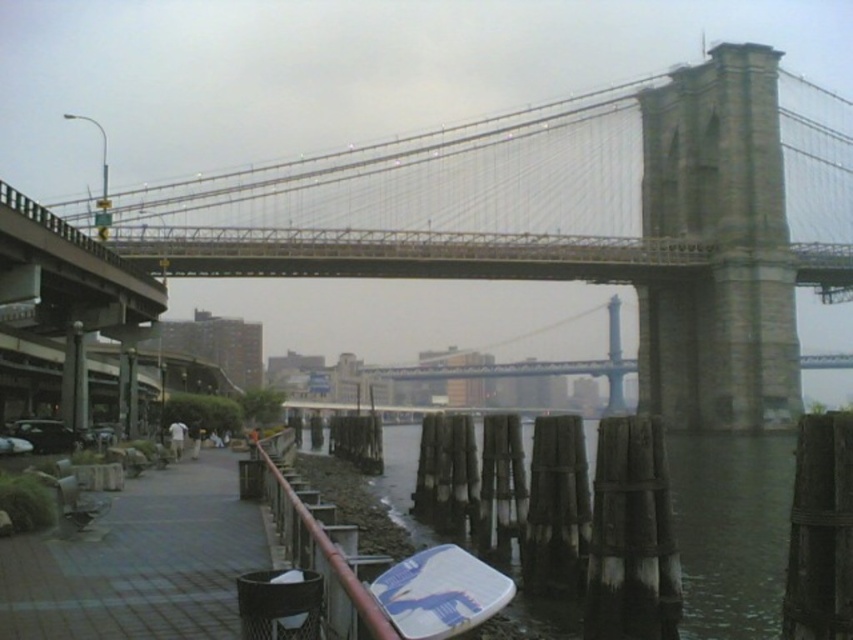
Question: Where is stone gray suspension bridge at center located in relation to brown wooden posts at lower center in the image?

Choices:
 (A) right
 (B) left

Answer: (B)

Question: Which object appears closest to the camera in this image?

Choices:
 (A) stone gray suspension bridge at center
 (B) brown wooden rail at lower left
 (C) brown wooden posts at lower center
 (D) wooden dock at lower left

Answer: (B)

Question: Where is stone gray suspension bridge at center located in relation to wooden dock at lower left in the image?

Choices:
 (A) above
 (B) below

Answer: (A)

Question: Observing the image, what is the correct spatial positioning of wooden dock at lower left in reference to brown wooden rail at lower left?

Choices:
 (A) below
 (B) above

Answer: (A)

Question: Which point is farther from the camera taking this photo?

Choices:
 (A) (216, 472)
 (B) (718, 451)

Answer: (B)

Question: Which of the following is the farthest from the observer?

Choices:
 (A) brown wooden posts at lower center
 (B) stone gray suspension bridge at center
 (C) wooden dock at lower left

Answer: (B)